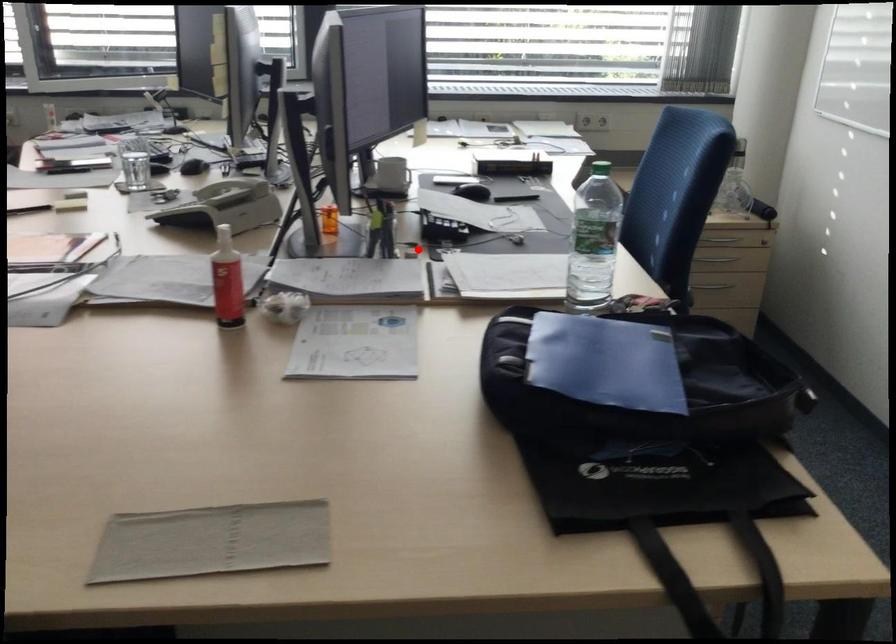
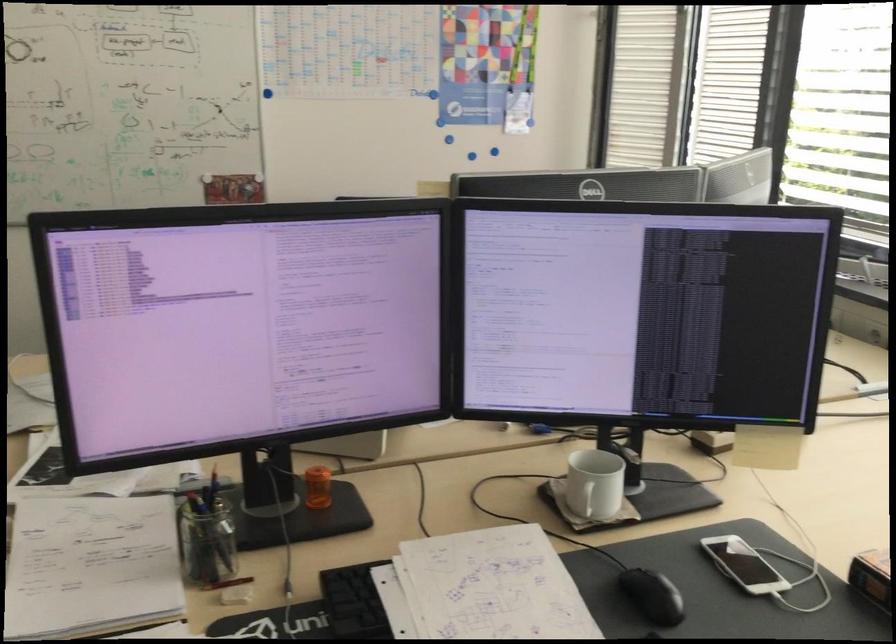
Where in the second image is the point corresponding to the highlighted location from the first image?

(234, 596)